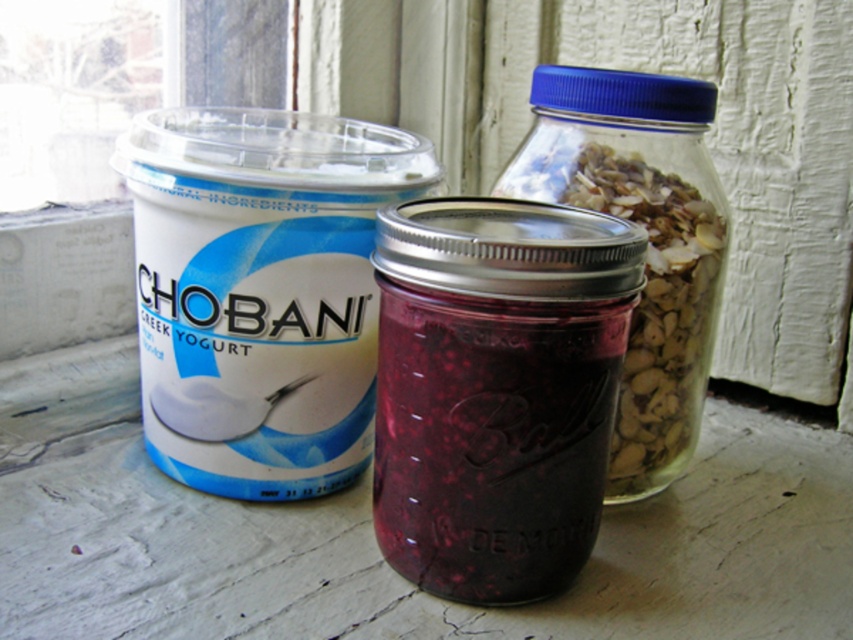
Based on the photo, you are standing 30 inches away from the white matte yogurt at left. Can you reach it without moving your feet?

The white matte yogurt at left is 27.14 inches away from the camera, so if you are standing 30 inches away, you can reach it without moving your feet.

You are organizing items on a windowsill and want to stack the white matte yogurt at left and the clear glass jar at center. Which item should you place at the bottom to ensure stability?

The clear glass jar at center should be placed at the bottom because it is taller than the white matte yogurt at left, providing a more stable base.

You are holding a spoon and want to reach the Chobani Greek Yogurt Container at point (230, 122). If your hand is currently 30 inches away from the container, how much farther do you need to move your hand to reach it?

The point (230, 122) is 35.86 inches away from the camera. Since your hand is currently 30 inches away, you need to move it an additional 5.86 inches to reach the yogurt container.